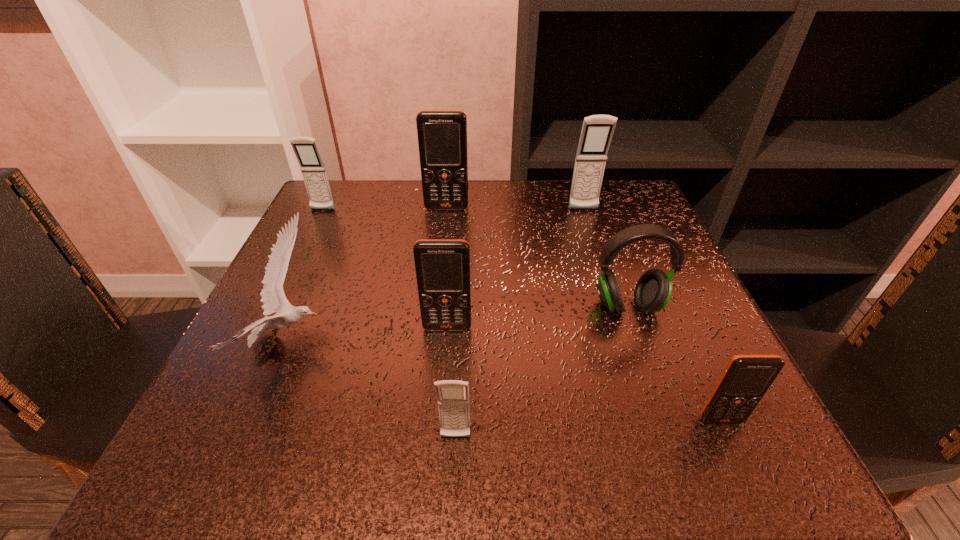
Find the location of a particular element. cellular telephone located at the left edge is located at coordinates (306, 150).

Identify the location of gull present at the left edge. (273, 298).

You are a GUI agent. You are given a task and a screenshot of the screen. Output one action in this format:
    pyautogui.click(x=<x>, y=<y>)
    Task: Click on the headset that is positioned at the right edge
    
    Given the screenshot: What is the action you would take?
    pyautogui.click(x=653, y=290)

Image resolution: width=960 pixels, height=540 pixels. I want to click on object that is positioned at the far left corner, so click(x=306, y=150).

Where is `object at the near left corner`? Image resolution: width=960 pixels, height=540 pixels. object at the near left corner is located at coordinates (273, 298).

This screenshot has width=960, height=540. Find the location of `object that is at the far right corner`. object that is at the far right corner is located at coordinates (597, 130).

Where is `object at the near right corner`? The image size is (960, 540). object at the near right corner is located at coordinates (746, 378).

The width and height of the screenshot is (960, 540). I want to click on free space at the far edge, so click(x=411, y=185).

Identify the location of vacant space at the near edge of the desktop. (520, 449).

In the image, there is a desktop. Identify the location of vacant space at the left edge. (260, 390).